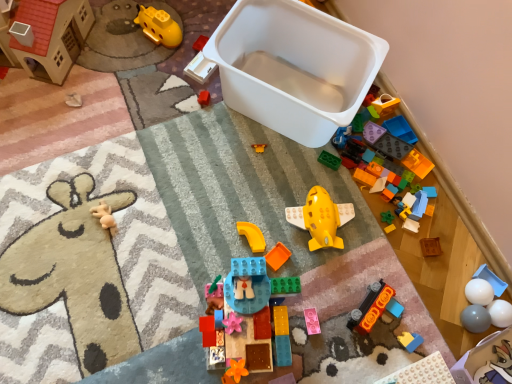
At what (x,y) coordinates should I click in order to perform the action: click on vacant space to the left of pink matte block at center, the tenth toy positioned from the right. Please return your answer as a coordinate pair (x, y). This screenshot has height=384, width=512. Looking at the image, I should click on (214, 306).